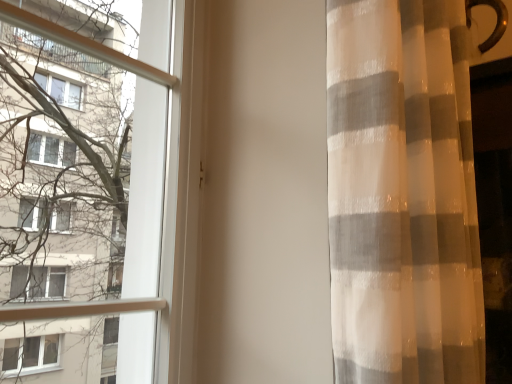
Measure the distance between translucent fabric curtain at right and camera.

A distance of 21.31 inches exists between translucent fabric curtain at right and camera.

Image resolution: width=512 pixels, height=384 pixels. What do you see at coordinates (397, 197) in the screenshot?
I see `translucent fabric curtain at right` at bounding box center [397, 197].

This screenshot has height=384, width=512. Identify the location of translucent fabric curtain at right. (397, 197).

The width and height of the screenshot is (512, 384). What are the coordinates of `translucent fabric curtain at right` in the screenshot? It's located at (397, 197).